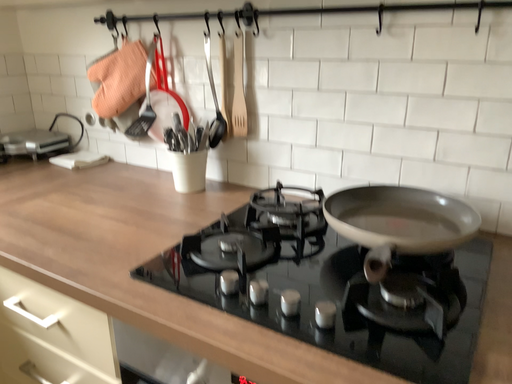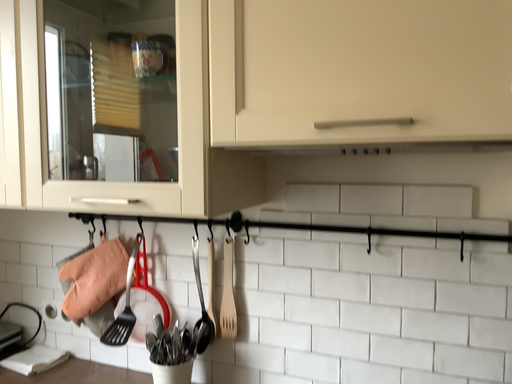
Question: Which way did the camera rotate in the video?

Choices:
 (A) rotated right
 (B) rotated left

Answer: (A)